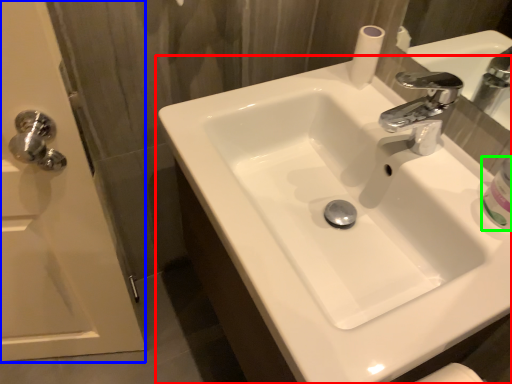
Question: Which is nearer to the sink (highlighted by a red box)? screen door (highlighted by a blue box) or mouthwash (highlighted by a green box).

Choices:
 (A) screen door
 (B) mouthwash

Answer: (B)